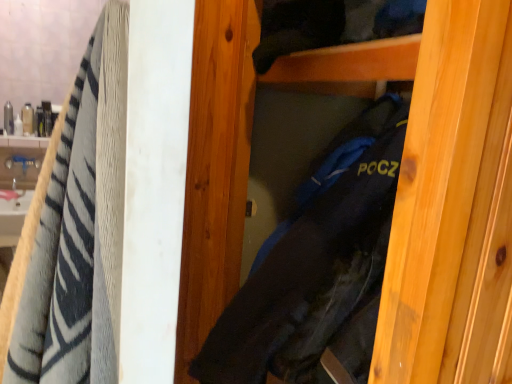
Question: Is black fabric bag at center smaller than white glossy sink at left?

Choices:
 (A) no
 (B) yes

Answer: (A)

Question: Considering the relative sizes of black fabric bag at center and white glossy sink at left in the image provided, is black fabric bag at center thinner than white glossy sink at left?

Choices:
 (A) no
 (B) yes

Answer: (A)

Question: From the image's perspective, is black fabric bag at center below white glossy sink at left?

Choices:
 (A) yes
 (B) no

Answer: (B)

Question: Considering the relative sizes of black fabric bag at center and white glossy sink at left in the image provided, is black fabric bag at center wider than white glossy sink at left?

Choices:
 (A) no
 (B) yes

Answer: (B)

Question: Does black fabric bag at center have a greater height compared to white glossy sink at left?

Choices:
 (A) no
 (B) yes

Answer: (B)

Question: Would you say soft cotton towel at left is to the left or to the right of black fabric bag at center in the picture?

Choices:
 (A) left
 (B) right

Answer: (A)

Question: Looking at the image, does soft cotton towel at left seem bigger or smaller compared to black fabric bag at center?

Choices:
 (A) small
 (B) big

Answer: (A)

Question: From a real-world perspective, is soft cotton towel at left physically located above or below black fabric bag at center?

Choices:
 (A) above
 (B) below

Answer: (B)

Question: In terms of height, does soft cotton towel at left look taller or shorter compared to black fabric bag at center?

Choices:
 (A) short
 (B) tall

Answer: (A)

Question: Is black fabric bag at center in front of or behind white glossy sink at left in the image?

Choices:
 (A) front
 (B) behind

Answer: (A)

Question: Looking at the image, does black fabric bag at center seem bigger or smaller compared to white glossy sink at left?

Choices:
 (A) big
 (B) small

Answer: (A)

Question: Would you say black fabric bag at center is inside or outside white glossy sink at left?

Choices:
 (A) inside
 (B) outside

Answer: (B)

Question: In terms of width, does black fabric bag at center look wider or thinner when compared to white glossy sink at left?

Choices:
 (A) thin
 (B) wide

Answer: (B)

Question: From the image's perspective, is white glossy sink at left positioned above or below black fabric bag at center?

Choices:
 (A) above
 (B) below

Answer: (B)

Question: Is white glossy sink at left bigger or smaller than black fabric bag at center?

Choices:
 (A) small
 (B) big

Answer: (A)